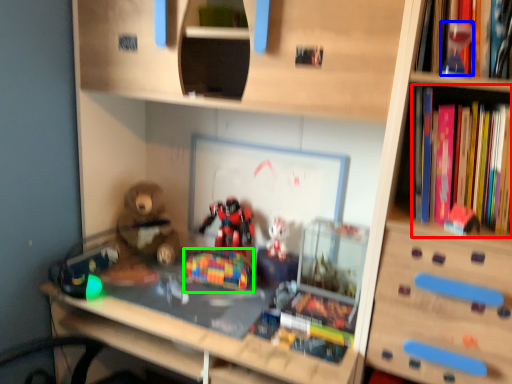
Question: Considering the real-world distances, which object is farthest from book (highlighted by a red box)? toy (highlighted by a blue box) or toy (highlighted by a green box)?

Choices:
 (A) toy
 (B) toy

Answer: (B)